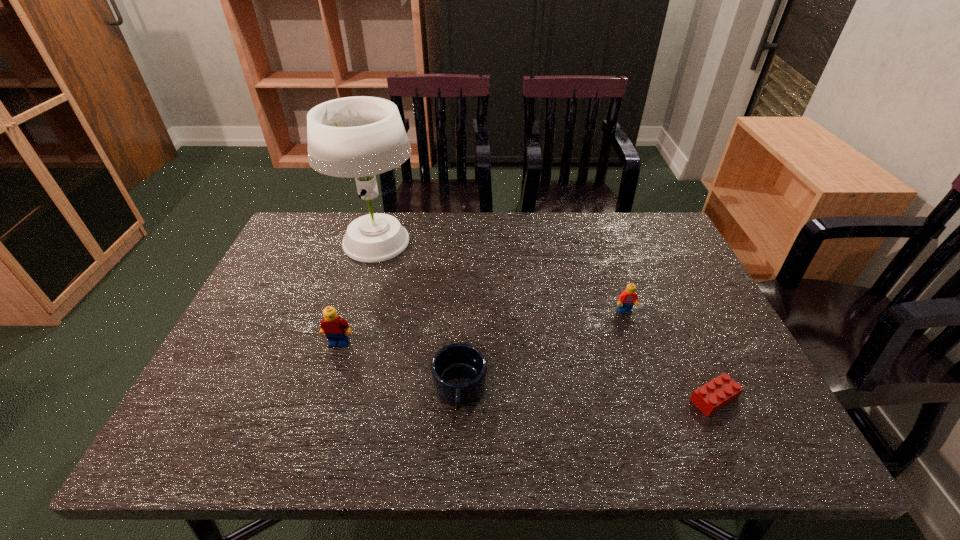
What are the coordinates of `free space located 0.110m on the front-facing side of the lamp` in the screenshot? It's located at (458, 244).

Identify the location of vacant area situated on the front-facing side of the second nearest Lego. (319, 408).

You are a GUI agent. You are given a task and a screenshot of the screen. Output one action in this format:
    pyautogui.click(x=<x>, y=<y>)
    Task: Click on the vacant space situated on the face of the third tallest object
    The height and width of the screenshot is (540, 960).
    Given the screenshot: What is the action you would take?
    pyautogui.click(x=633, y=333)

What are the coordinates of `free location located 0.060m with the handle on the side of the mug` in the screenshot? It's located at (457, 447).

Where is `blank area located on the back of the nearest Lego`? The width and height of the screenshot is (960, 540). blank area located on the back of the nearest Lego is located at coordinates (665, 293).

The width and height of the screenshot is (960, 540). I want to click on object at the far edge, so click(361, 136).

The image size is (960, 540). Identify the location of mug that is positioned at the near edge. (459, 372).

Image resolution: width=960 pixels, height=540 pixels. Find the location of `Lego at the near edge`. Lego at the near edge is located at coordinates (719, 392).

Identify the location of object that is at the left edge. (361, 136).

Locate an element on the screen. object present at the right edge is located at coordinates (719, 392).